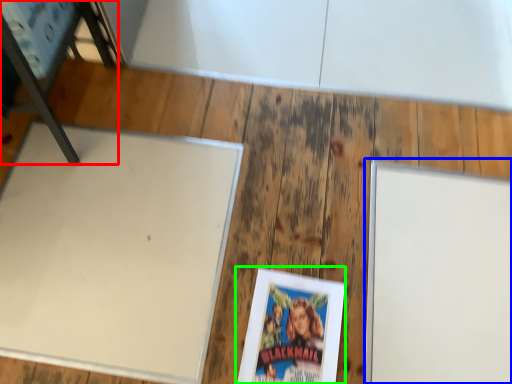
Question: Estimate the real-world distances between objects in this image. Which object is farther from furniture (highlighted by a red box), bulletin board (highlighted by a blue box) or paperback book (highlighted by a green box)?

Choices:
 (A) bulletin board
 (B) paperback book

Answer: (A)